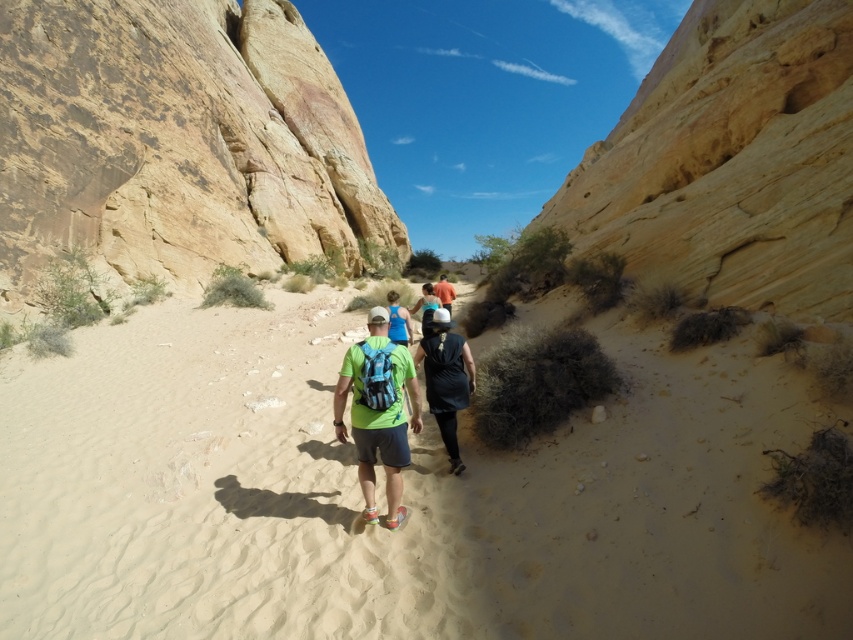
Question: From the image, what is the correct spatial relationship of green fabric backpack at center in relation to orange fabric shirt at center?

Choices:
 (A) left
 (B) right

Answer: (A)

Question: Which point is farther from the camera taking this photo?

Choices:
 (A) (59, 131)
 (B) (440, 300)

Answer: (A)

Question: In this image, where is green fabric backpack at center located relative to orange fabric shirt at center?

Choices:
 (A) right
 (B) left

Answer: (B)

Question: Is light beige sand at center wider than orange fabric shirt at center?

Choices:
 (A) no
 (B) yes

Answer: (B)

Question: Estimate the real-world distances between objects in this image. Which object is farther from the orange fabric shirt at center?

Choices:
 (A) green fabric backpack at center
 (B) light beige sand at center
 (C) black matte backpack at center
 (D) rustic sandstone rock at upper left

Answer: (D)

Question: Considering the real-world distances, which object is farthest from the rustic sandstone rock at upper left?

Choices:
 (A) light beige sand at center
 (B) orange fabric shirt at center

Answer: (B)